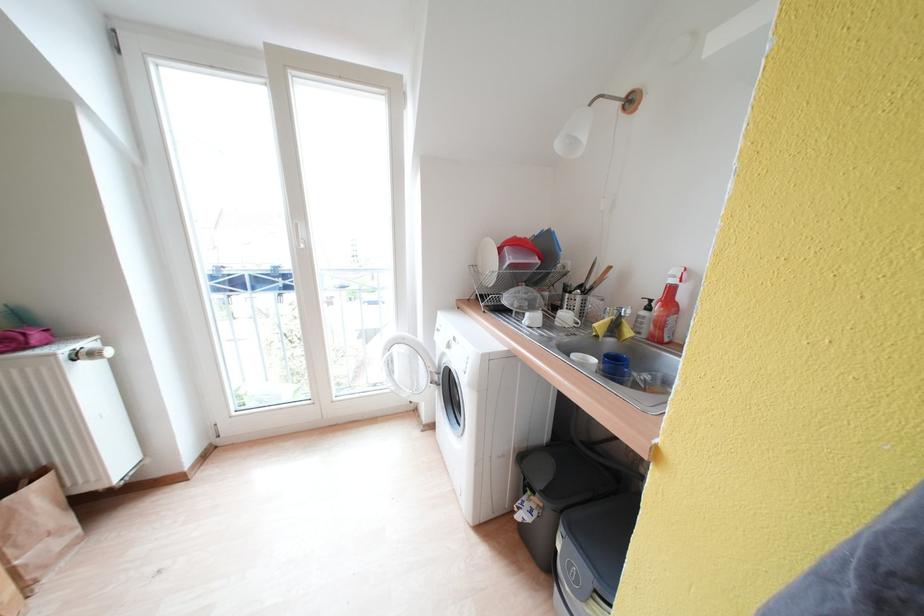
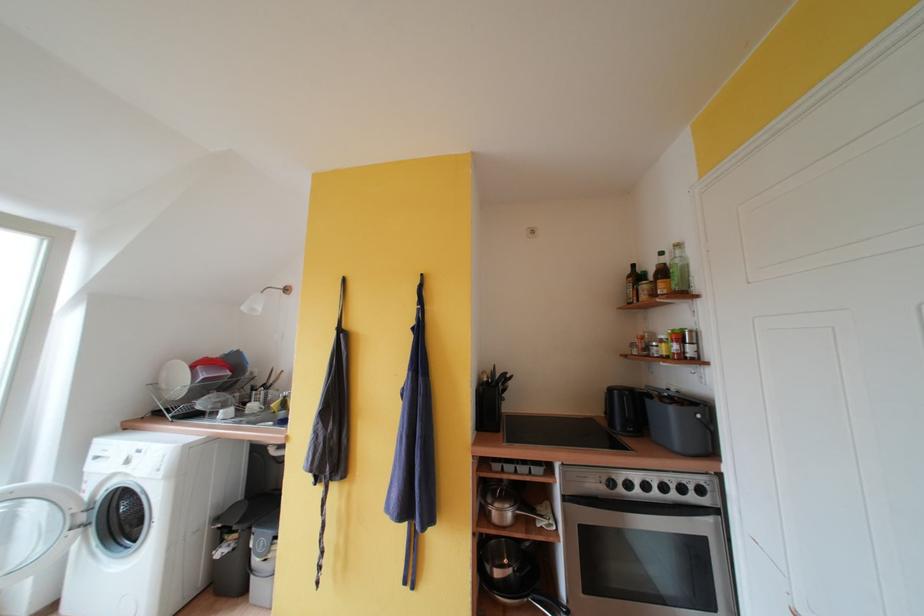
Locate, in the second image, the point that corresponds to [505,254] in the first image.

(199, 371)